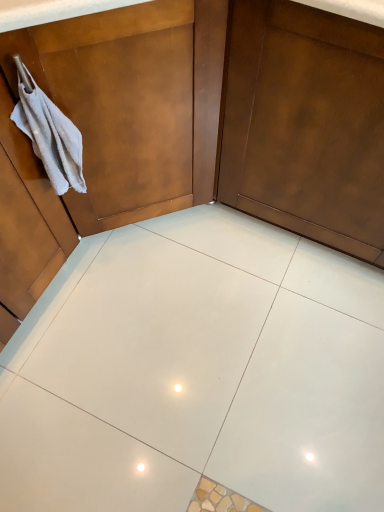
Question: Should I look upward or downward to see matte brown dresser at upper left?

Choices:
 (A) up
 (B) down

Answer: (A)

Question: Would you say white glossy tile at center is part of matte brown dresser at upper left's contents?

Choices:
 (A) yes
 (B) no

Answer: (B)

Question: From the image's perspective, does matte brown dresser at upper left appear higher than white glossy tile at center?

Choices:
 (A) no
 (B) yes

Answer: (B)

Question: Is matte brown dresser at upper left closer to the viewer compared to white glossy tile at center?

Choices:
 (A) yes
 (B) no

Answer: (A)

Question: From a real-world perspective, is matte brown dresser at upper left positioned over white glossy tile at center based on gravity?

Choices:
 (A) no
 (B) yes

Answer: (B)

Question: Can you confirm if matte brown dresser at upper left is taller than white glossy tile at center?

Choices:
 (A) yes
 (B) no

Answer: (A)

Question: From the image's perspective, is matte brown dresser at upper left below white glossy tile at center?

Choices:
 (A) no
 (B) yes

Answer: (A)

Question: Is white glossy tile at center bigger than white cotton hand towel at left?

Choices:
 (A) yes
 (B) no

Answer: (A)

Question: Considering the relative sizes of white glossy tile at center and white cotton hand towel at left in the image provided, is white glossy tile at center shorter than white cotton hand towel at left?

Choices:
 (A) no
 (B) yes

Answer: (B)

Question: From a real-world perspective, is white glossy tile at center on top of white cotton hand towel at left?

Choices:
 (A) no
 (B) yes

Answer: (A)

Question: Is the position of white glossy tile at center more distant than that of white cotton hand towel at left?

Choices:
 (A) yes
 (B) no

Answer: (A)

Question: Could you tell me if white glossy tile at center is facing white cotton hand towel at left?

Choices:
 (A) no
 (B) yes

Answer: (A)

Question: Considering the relative sizes of white glossy tile at center and white cotton hand towel at left in the image provided, is white glossy tile at center taller than white cotton hand towel at left?

Choices:
 (A) no
 (B) yes

Answer: (A)

Question: Does white glossy tile at center have a smaller size compared to matte brown door at center?

Choices:
 (A) no
 (B) yes

Answer: (B)